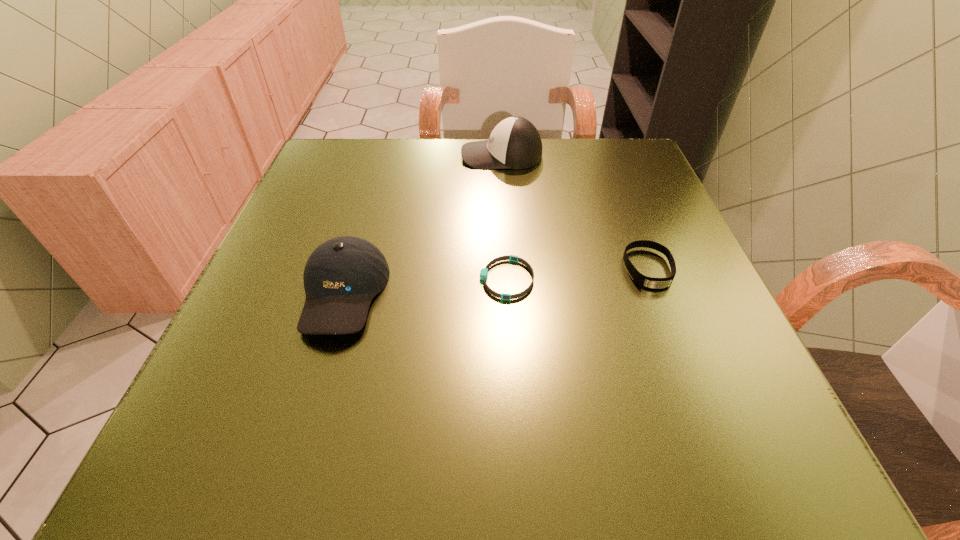
The width and height of the screenshot is (960, 540). What are the coordinates of `unoccupied position between the second shortest object and the tallest object` in the screenshot? It's located at (575, 212).

The image size is (960, 540). Find the location of `empty location between the farthest object and the second tallest object`. empty location between the farthest object and the second tallest object is located at coordinates (422, 224).

The width and height of the screenshot is (960, 540). Find the location of `free area in between the baseball cap and the cap`. free area in between the baseball cap and the cap is located at coordinates (422, 224).

The width and height of the screenshot is (960, 540). Identify the location of vacant space that is in between the shortest object and the third tallest object. (578, 274).

You are a GUI agent. You are given a task and a screenshot of the screen. Output one action in this format:
    pyautogui.click(x=<x>, y=<y>)
    Task: Click on the blank region between the taller wristband and the third shortest object
    The image size is (960, 540).
    Given the screenshot: What is the action you would take?
    pyautogui.click(x=495, y=281)

This screenshot has height=540, width=960. I want to click on object that stands as the third closest to the farthest object, so click(x=484, y=271).

This screenshot has height=540, width=960. I want to click on object that is the second closest to the left wristband, so click(647, 282).

The width and height of the screenshot is (960, 540). Identify the location of free location that satisfies the following two spatial constraints: 1. on the front panel of the cap; 2. on the front-facing side of the baseball cap. (511, 293).

Where is `blank space that satisfies the following two spatial constraints: 1. on the buckle of the left wristband; 2. on the front-facing side of the baseball cap`? The image size is (960, 540). blank space that satisfies the following two spatial constraints: 1. on the buckle of the left wristband; 2. on the front-facing side of the baseball cap is located at coordinates (508, 293).

In order to click on free space that satisfies the following two spatial constraints: 1. on the buckle of the shortest object; 2. on the front-facing side of the third shortest object in this screenshot , I will do `click(508, 293)`.